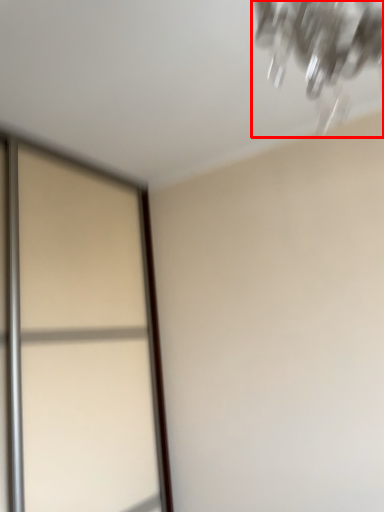
Question: Where is lamp (annotated by the red box) located in relation to screen door in the image?

Choices:
 (A) right
 (B) left

Answer: (A)